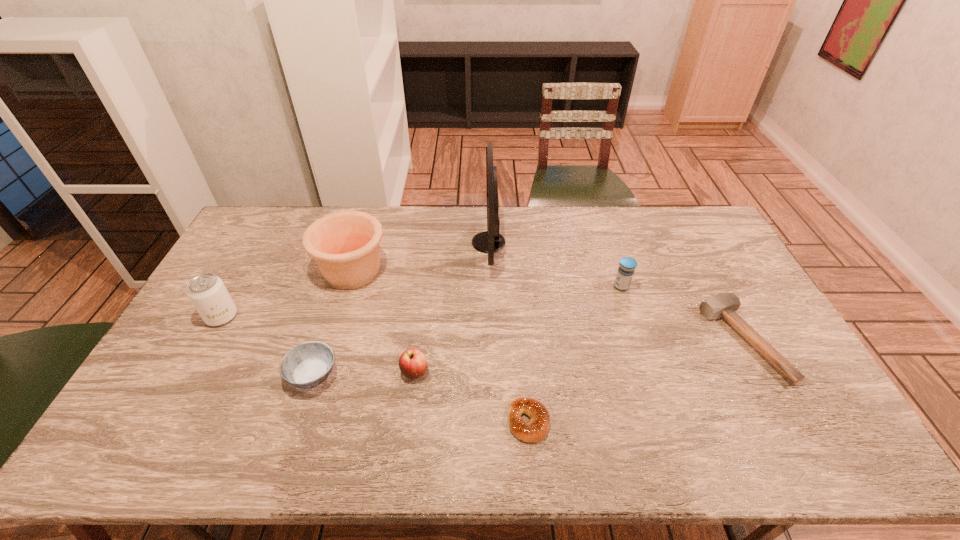
At what (x,y) coordinates should I click in order to perform the action: click on bagel. Please return your answer as a coordinate pair (x, y). Looking at the image, I should click on (534, 431).

This screenshot has height=540, width=960. What are the coordinates of `the nearest object` in the screenshot? It's located at (534, 431).

I want to click on blank space located on the front-facing side of the computer monitor, so click(408, 242).

Locate an element on the screen. The image size is (960, 540). vacant point located on the front-facing side of the computer monitor is located at coordinates (368, 242).

This screenshot has height=540, width=960. Find the location of `vacant position located on the front-facing side of the computer monitor`. vacant position located on the front-facing side of the computer monitor is located at coordinates (446, 242).

In order to click on vacant region located on the front of the pottery in this screenshot , I will do `click(313, 400)`.

Image resolution: width=960 pixels, height=540 pixels. I want to click on vacant area situated 0.250m on the back of the leftmost object, so click(x=257, y=253).

Find the location of a particular element. This screenshot has height=540, width=960. vacant space situated on the right of the medicine is located at coordinates (662, 287).

At what (x,y) coordinates should I click in order to perform the action: click on vacant space located on the back of the apple. Please return your answer as a coordinate pair (x, y). The width and height of the screenshot is (960, 540). Looking at the image, I should click on (420, 338).

Find the location of a particular element. free region located on the front of the third shortest object is located at coordinates (296, 431).